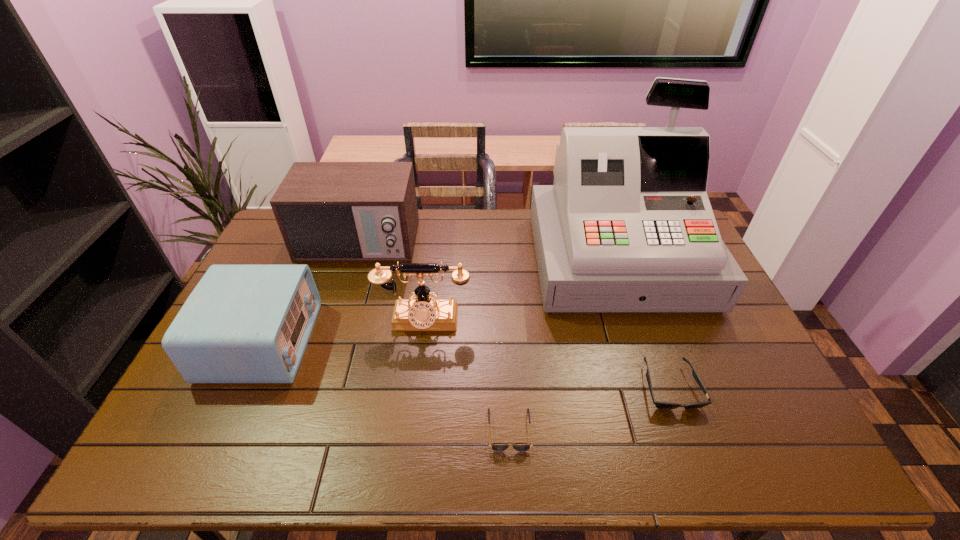
Identify the location of vacant region located on the front-facing side of the farther radio receiver. The image size is (960, 540). (324, 349).

Find the location of a particular element. The width and height of the screenshot is (960, 540). vacant space situated 0.270m on the dial of the telephone is located at coordinates (411, 421).

Where is `vacant region located on the front panel of the shorter radio receiver`? This screenshot has width=960, height=540. vacant region located on the front panel of the shorter radio receiver is located at coordinates (345, 341).

At what (x,y) coordinates should I click in order to perform the action: click on vacant space situated 0.050m on the front-facing side of the second shortest object. Please return your answer as a coordinate pair (x, y). This screenshot has width=960, height=540. Looking at the image, I should click on (686, 433).

Identify the location of cash register that is at the far edge. Image resolution: width=960 pixels, height=540 pixels. (627, 226).

Image resolution: width=960 pixels, height=540 pixels. What are the coordinates of `radio receiver situated at the far edge` in the screenshot? It's located at point(326,211).

Identify the location of object that is positioned at the near edge. (496, 447).

The width and height of the screenshot is (960, 540). Identify the location of object that is at the right edge. (627, 226).

Image resolution: width=960 pixels, height=540 pixels. Identify the location of object that is at the far left corner. (326, 211).

Where is `object that is at the far right corner`? The height and width of the screenshot is (540, 960). object that is at the far right corner is located at coordinates (627, 226).